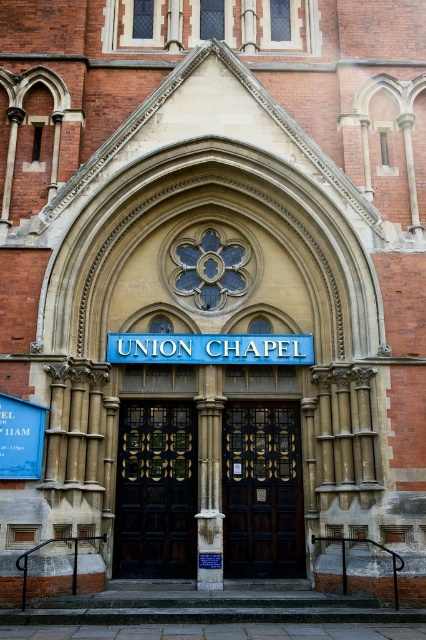
From the picture: You are a visitor at the Union Chapel entrance. You need to enter the building but are unsure if you can reach the dark wood door at center from your current position near the blue metallic sign at center. The maximum distance you can walk is 8 meters. Can you reach the door?

The dark wood door at center is 8.38 meters from the blue metallic sign at center. Since the maximum distance you can walk is 8 meters, you cannot reach the door as the distance exceeds your walking limit.

You are standing at the entrance of the Union Chapel and want to find the main door. According to the image, where exactly is the dark wood door at center located?

The dark wood door at center is located at point (x=261, y=490).

You are standing at the entrance of the Union Chapel and want to enter. There are two doors here, the black polished wood door at center and the dark wood door at center. Which door should you open first to get inside?

The black polished wood door at center is in front of the dark wood door at center, so you should open the black polished wood door at center first to access the area behind it.